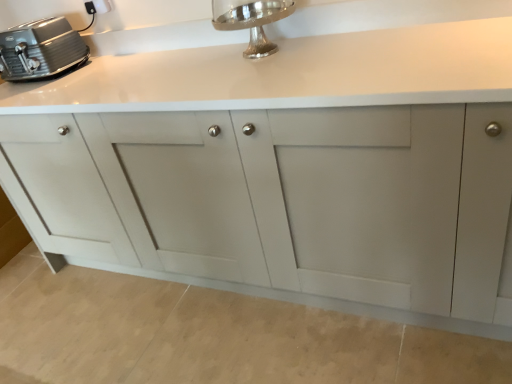
Question: Should I look upward or downward to see matte gray cabinet at center?

Choices:
 (A) down
 (B) up

Answer: (B)

Question: From a real-world perspective, is white plastic electric outlet at upper left on top of satin silver toaster at upper left?

Choices:
 (A) no
 (B) yes

Answer: (B)

Question: Does white plastic electric outlet at upper left lie behind satin silver toaster at upper left?

Choices:
 (A) yes
 (B) no

Answer: (A)

Question: Is white plastic electric outlet at upper left completely or partially outside of satin silver toaster at upper left?

Choices:
 (A) no
 (B) yes

Answer: (B)

Question: Considering the relative positions of white plastic electric outlet at upper left and satin silver toaster at upper left in the image provided, is white plastic electric outlet at upper left to the left of satin silver toaster at upper left from the viewer's perspective?

Choices:
 (A) yes
 (B) no

Answer: (B)

Question: Considering the relative positions of white plastic electric outlet at upper left and satin silver toaster at upper left in the image provided, is white plastic electric outlet at upper left to the right of satin silver toaster at upper left from the viewer's perspective?

Choices:
 (A) no
 (B) yes

Answer: (B)

Question: Considering the relative sizes of white plastic electric outlet at upper left and satin silver toaster at upper left in the image provided, is white plastic electric outlet at upper left smaller than satin silver toaster at upper left?

Choices:
 (A) yes
 (B) no

Answer: (A)

Question: Is white plastic electric outlet at upper left with silver polished faucet at upper center?

Choices:
 (A) no
 (B) yes

Answer: (A)

Question: Is white plastic electric outlet at upper left further to camera compared to silver polished faucet at upper center?

Choices:
 (A) no
 (B) yes

Answer: (B)

Question: Does white plastic electric outlet at upper left have a lesser height compared to silver polished faucet at upper center?

Choices:
 (A) no
 (B) yes

Answer: (B)

Question: Is white plastic electric outlet at upper left in front of silver polished faucet at upper center?

Choices:
 (A) no
 (B) yes

Answer: (A)

Question: Is white plastic electric outlet at upper left surrounding silver polished faucet at upper center?

Choices:
 (A) yes
 (B) no

Answer: (B)

Question: Is white plastic electric outlet at upper left to the right of silver polished faucet at upper center from the viewer's perspective?

Choices:
 (A) no
 (B) yes

Answer: (A)

Question: From a real-world perspective, is matte gray cabinet at center beneath silver polished faucet at upper center?

Choices:
 (A) no
 (B) yes

Answer: (B)